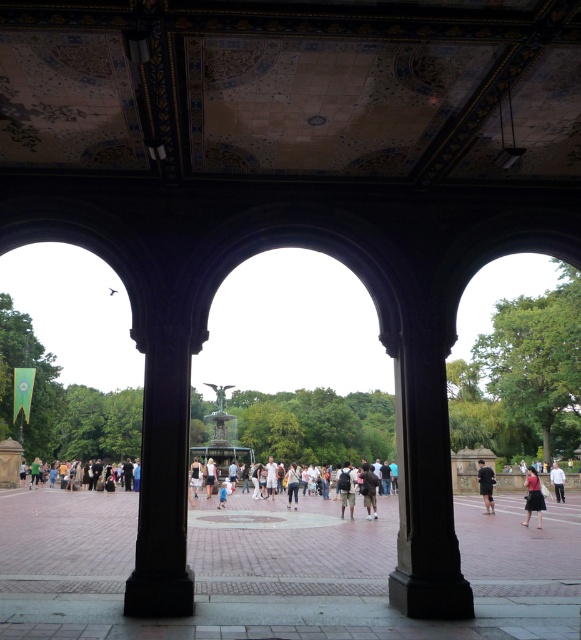
Between point (213, 468) and point (229, 483), which one is positioned behind?

Positioned behind is point (229, 483).

What do you see at coordinates (209, 476) in the screenshot? I see `light brown leather jacket at center` at bounding box center [209, 476].

Who is more distant from viewer, (205,467) or (231,492)?

The point (205,467) is more distant.

Locate an element on the screen. This screenshot has height=640, width=581. light brown leather jacket at center is located at coordinates (209, 476).

Can you confirm if matte black dress at lower right is positioned to the left of light brown leather jacket at center?

No, matte black dress at lower right is not to the left of light brown leather jacket at center.

Describe the element at coordinates (533, 497) in the screenshot. I see `matte black dress at lower right` at that location.

At what (x,y) coordinates should I click in order to perform the action: click on matte black dress at lower right. Please return your answer as a coordinate pair (x, y). The height and width of the screenshot is (640, 581). Looking at the image, I should click on (533, 497).

Does dark brown leather backpack at center have a lesser width compared to dark gray fabric dress at center?

No.

Which is more to the right, dark brown leather backpack at center or dark gray fabric dress at center?

From the viewer's perspective, dark brown leather backpack at center appears more on the right side.

Is point (365, 497) positioned behind point (195, 476)?

No, it is not.

Locate an element on the screen. dark brown leather backpack at center is located at coordinates (368, 488).